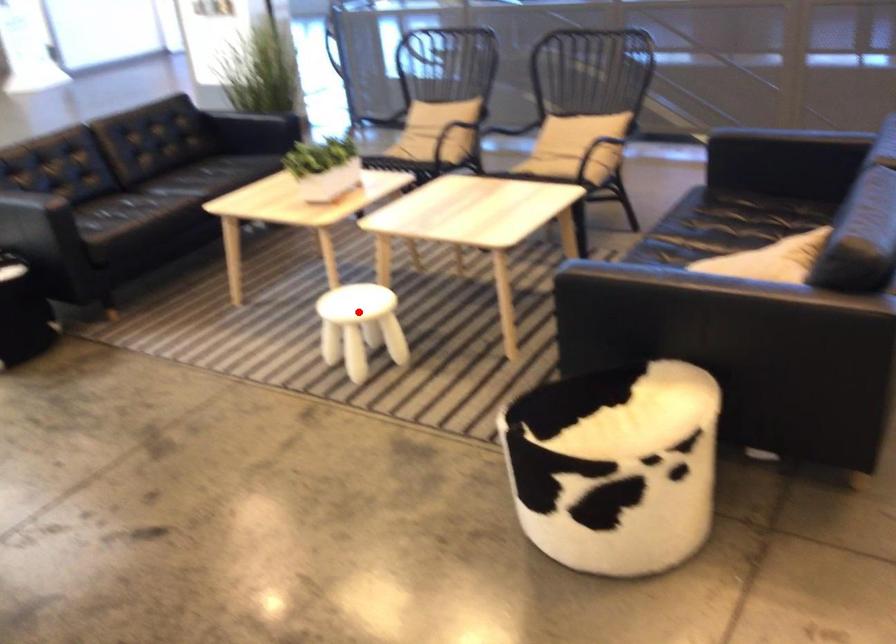
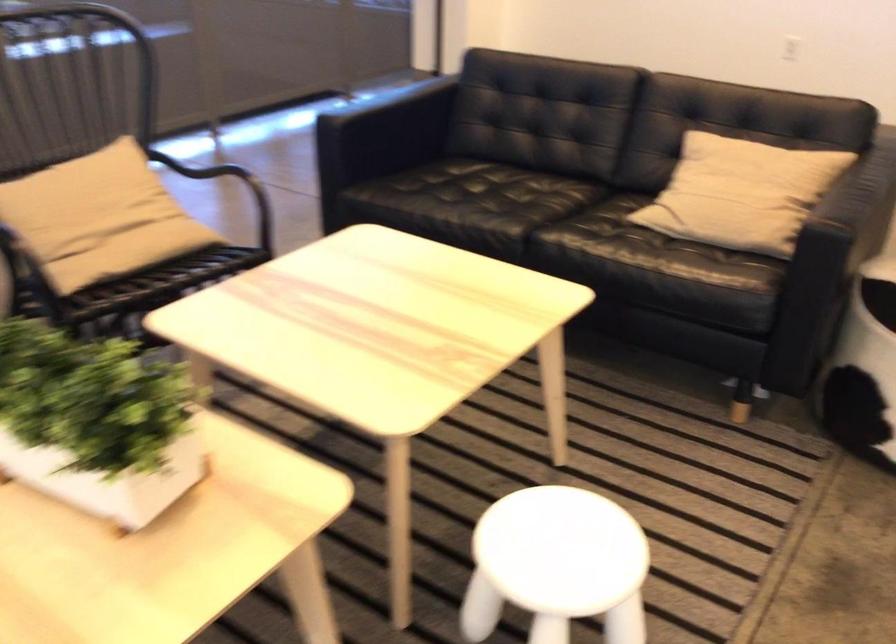
Question: A red point is marked in image1. In image2, is the corresponding 3D point closer to the camera or farther? Reply with the corresponding letter.

Choices:
 (A) The corresponding 3D point is closer.
 (B) The corresponding 3D point is farther.

Answer: (A)